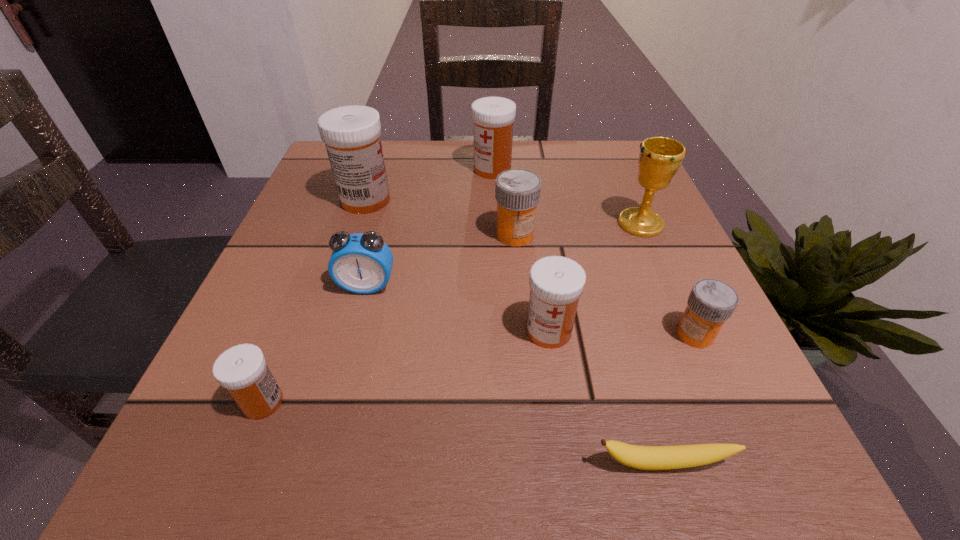
At what (x,y) coordinates should I click in order to perform the action: click on the right orange medicine. Please return your answer as a coordinate pair (x, y). Image resolution: width=960 pixels, height=540 pixels. Looking at the image, I should click on (711, 302).

Locate an element on the screen. This screenshot has width=960, height=540. the second nearest object is located at coordinates (242, 370).

Locate an element on the screen. the smallest white medicine is located at coordinates (242, 370).

Locate an element on the screen. yellow banana is located at coordinates (639, 457).

The width and height of the screenshot is (960, 540). I want to click on banana, so click(639, 457).

Identify the location of free space located on the front of the fifth nearest medicine. (324, 327).

The image size is (960, 540). What are the coordinates of `vacant space situated on the left of the gold chalice` in the screenshot? It's located at (455, 224).

You are a GUI agent. You are given a task and a screenshot of the screen. Output one action in this format:
    pyautogui.click(x=<x>, y=<y>)
    Task: Click on the free location located 0.100m on the right of the third smallest white medicine
    The height and width of the screenshot is (540, 960).
    Given the screenshot: What is the action you would take?
    pyautogui.click(x=556, y=169)

Locate an element on the screen. The height and width of the screenshot is (540, 960). vacant space located on the label side of the left orange medicine is located at coordinates tap(534, 448).

This screenshot has height=540, width=960. What are the coordinates of `vacant space situated on the left of the third biggest white medicine` in the screenshot? It's located at (486, 331).